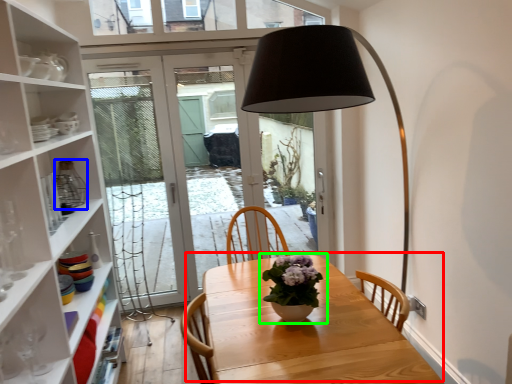
Question: Which object is the closest to the table (highlighted by a red box)? Choose among these: glass vase (highlighted by a blue box) or houseplant (highlighted by a green box).

Choices:
 (A) glass vase
 (B) houseplant

Answer: (B)